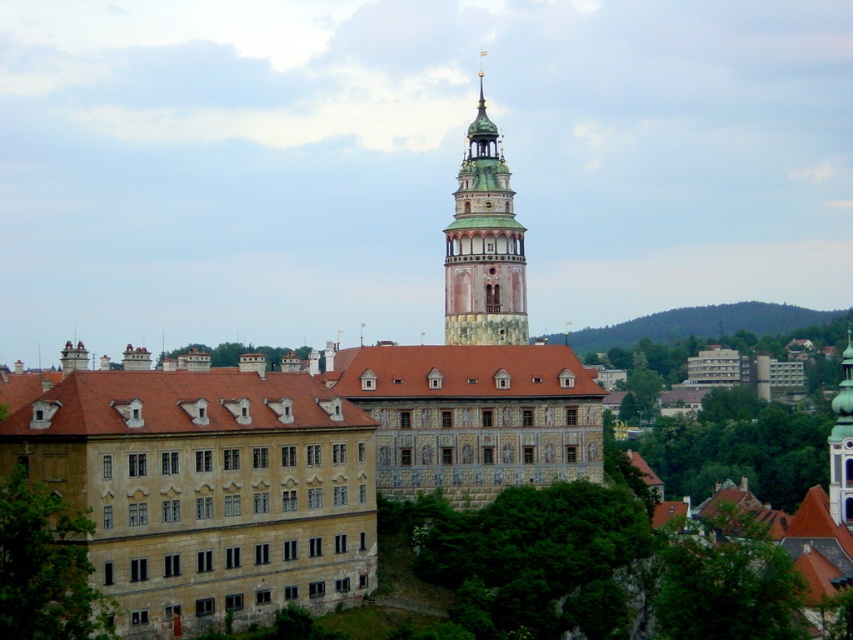
You are an architect visiting the historic site and need to determine which structure is more suitable for hosting a small exhibition. Based on their sizes, which of the two structures, the brown stone building at center or the green wooden bell tower at center, would you recommend?

The brown stone building at center has a larger size compared to the green wooden bell tower at center, so it would be more suitable for hosting a small exhibition due to its greater space availability.

You are a visitor standing at the base of the green wooden bell tower at center, looking towards the green grassy hillside at upper right. Which object is taller when viewed from your current position?

The green wooden bell tower at center is taller than the green grassy hillside at upper right, so the bell tower appears taller from your position.